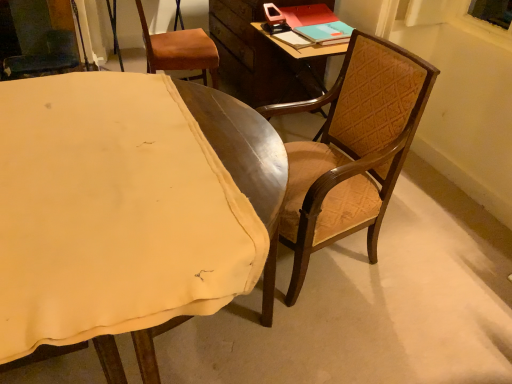
Question: Visually, is wooden chair at center, which is counted as the 2th chair, starting from the back, positioned to the left or to the right of wooden chair at right, which is the third chair from back to front?

Choices:
 (A) left
 (B) right

Answer: (B)

Question: Do you think wooden chair at center, positioned as the second chair in front-to-back order, is within wooden chair at right, which is the third chair from back to front, or outside of it?

Choices:
 (A) outside
 (B) inside

Answer: (A)

Question: Which of these objects is positioned farthest from the teal matte book at upper right?

Choices:
 (A) wooden chair at center, which is counted as the 2th chair, starting from the back
 (B) wooden chair at right, the first chair positioned from the front
 (C) brown leather chair at upper left, positioned as the 3th chair in front-to-back order

Answer: (B)

Question: Which object is positioned closest to the brown leather chair at upper left, positioned as the 3th chair in front-to-back order?

Choices:
 (A) wooden chair at center, positioned as the second chair in front-to-back order
 (B) wooden chair at right, which is the third chair from back to front
 (C) teal matte book at upper right

Answer: (C)